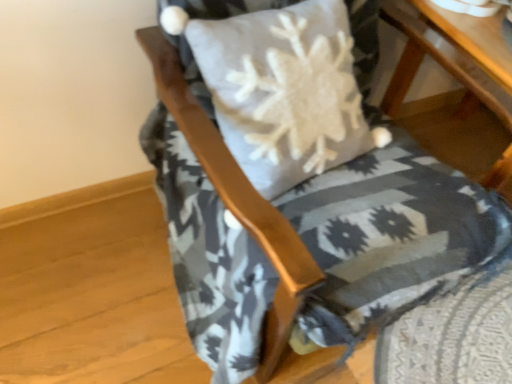
Question: From a real-world perspective, is textured gray cushion at center above or below wooden table at lower right?

Choices:
 (A) above
 (B) below

Answer: (A)

Question: Is textured gray cushion at center in front of or behind wooden table at lower right in the image?

Choices:
 (A) behind
 (B) front

Answer: (B)

Question: From their relative heights in the image, would you say textured gray cushion at center is taller or shorter than wooden table at lower right?

Choices:
 (A) short
 (B) tall

Answer: (B)

Question: Is wooden table at lower right wider or thinner than textured gray cushion at center?

Choices:
 (A) thin
 (B) wide

Answer: (A)

Question: Is wooden table at lower right taller or shorter than textured gray cushion at center?

Choices:
 (A) short
 (B) tall

Answer: (A)

Question: From a real-world perspective, is wooden table at lower right above or below textured gray cushion at center?

Choices:
 (A) above
 (B) below

Answer: (B)

Question: From the image's perspective, is wooden table at lower right located above or below textured gray cushion at center?

Choices:
 (A) above
 (B) below

Answer: (A)